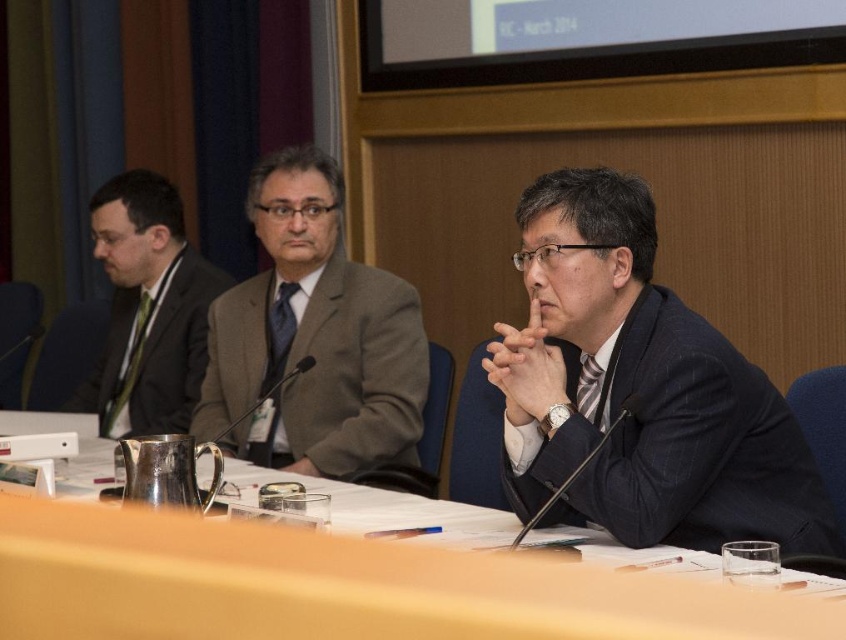
Question: Can you confirm if dark blue textured suit at center is positioned to the right of green silk business suit at left?

Choices:
 (A) no
 (B) yes

Answer: (B)

Question: Estimate the real-world distances between objects in this image. Which object is closer to the green silk business suit at left?

Choices:
 (A) smooth wooden table at center
 (B) dark blue textured suit at center

Answer: (A)

Question: Does smooth wooden table at center appear under green silk business suit at left?

Choices:
 (A) yes
 (B) no

Answer: (A)

Question: Is dark blue textured suit at center positioned in front of gray woolen suit at center?

Choices:
 (A) yes
 (B) no

Answer: (A)

Question: Which of the following is the farthest from the observer?

Choices:
 (A) dark blue textured suit at center
 (B) smooth wooden table at center
 (C) gray woolen suit at center
 (D) green silk business suit at left

Answer: (D)

Question: Which object is closer to the camera taking this photo?

Choices:
 (A) green silk business suit at left
 (B) gray woolen suit at center
 (C) dark blue textured suit at center

Answer: (C)